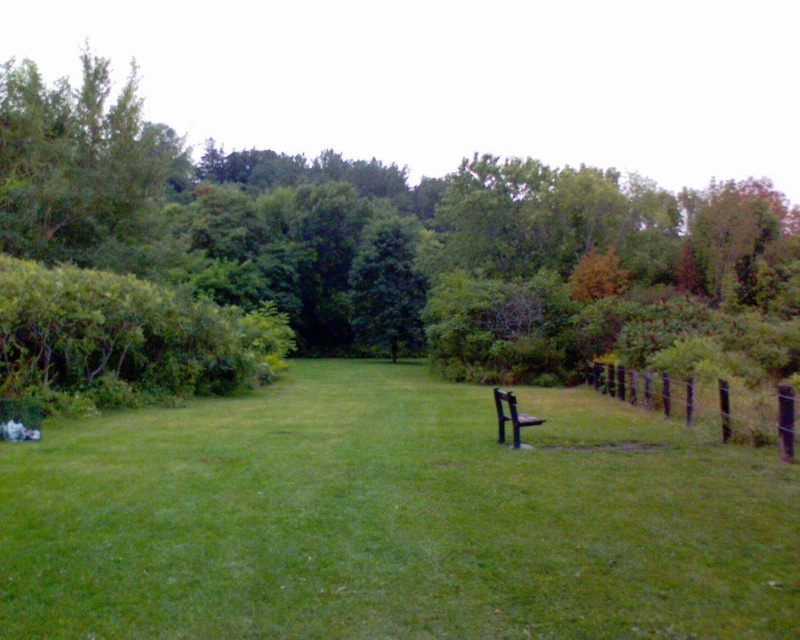
You are planning to place a new flowerpot that is 1.2 meters tall in this garden scene. Given the brown wooden fence at right and the black metal bench at center, which object would the flowerpot tower over?

The flowerpot would tower over the brown wooden fence at right since it is shorter than the flowerpot. The black metal bench at center is taller than the fence but the flowerpot is 1.2 meters tall, so if the bench is taller than 1.2 meters, it might not be over it. However, based on the given information, the fence is shorter than the bench, but we don

You are standing in the park and want to take a photo of the green grassy at center and the brown wooden fence at right. Which object should you focus on first to ensure both are in clear view?

You should focus on the green grassy at center first since it is closer to the viewer than the brown wooden fence at right, ensuring both are in focus when using a camera with depth of field considerations.

You are standing in the park and want to find the brown wooden fence at right. Based on the coordinates provided, where would you look relative to the center of the image?

The brown wooden fence at right is located at coordinates point 0.631 on the x axis and 0.884 on the y axis, which places it to the right and slightly above the center of the image.